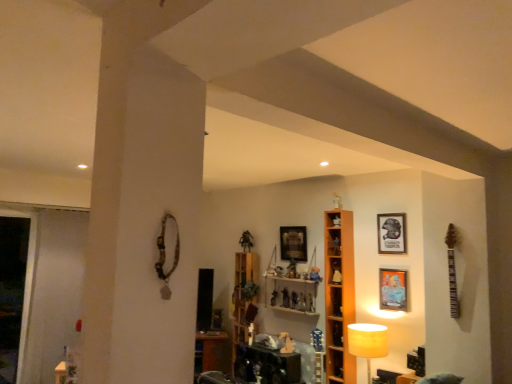
Question: Would you say wooden picture frame at upper center, the first picture frame from the back, is part of matte plastic figurine at center, positioned as the 4th toy in left-to-right order,'s contents?

Choices:
 (A) yes
 (B) no

Answer: (B)

Question: Considering the relative sizes of matte plastic figurine at center, the 1th toy in the right-to-left sequence, and wooden picture frame at upper center, the 1th picture frame from the left, in the image provided, is matte plastic figurine at center, the 1th toy in the right-to-left sequence, wider than wooden picture frame at upper center, the 1th picture frame from the left,?

Choices:
 (A) no
 (B) yes

Answer: (A)

Question: Is matte plastic figurine at center, positioned as the 4th toy in left-to-right order, not near wooden picture frame at upper center, which appears as the third picture frame when viewed from the front?

Choices:
 (A) no
 (B) yes

Answer: (A)

Question: Is matte plastic figurine at center, positioned as the 4th toy in left-to-right order, looking in the opposite direction of wooden picture frame at upper center, the 1th picture frame from the left?

Choices:
 (A) no
 (B) yes

Answer: (A)

Question: Considering the relative sizes of matte plastic figurine at center, positioned as the 4th toy in left-to-right order, and wooden picture frame at upper center, acting as the 3th picture frame starting from the right, in the image provided, is matte plastic figurine at center, positioned as the 4th toy in left-to-right order, smaller than wooden picture frame at upper center, acting as the 3th picture frame starting from the right,?

Choices:
 (A) yes
 (B) no

Answer: (A)

Question: Is matte black picture frame at upper right, the 2th picture frame when ordered from front to back, situated inside white fabric lampshade at lower right or outside?

Choices:
 (A) outside
 (B) inside

Answer: (A)

Question: From their relative heights in the image, would you say matte black picture frame at upper right, which is counted as the 2th picture frame, starting from the back, is taller or shorter than white fabric lampshade at lower right?

Choices:
 (A) short
 (B) tall

Answer: (B)

Question: Considering the positions of matte black picture frame at upper right, the 2th picture frame when ordered from front to back, and white fabric lampshade at lower right in the image, is matte black picture frame at upper right, the 2th picture frame when ordered from front to back, wider or thinner than white fabric lampshade at lower right?

Choices:
 (A) thin
 (B) wide

Answer: (A)

Question: Considering their positions, is matte black picture frame at upper right, which is counted as the 1th picture frame, starting from the right, located in front of or behind white fabric lampshade at lower right?

Choices:
 (A) front
 (B) behind

Answer: (B)

Question: In terms of height, does matte black picture frame at upper right, which is counted as the 1th picture frame, starting from the right, look taller or shorter compared to transparent glass door at left?

Choices:
 (A) short
 (B) tall

Answer: (A)

Question: In the image, is matte black picture frame at upper right, the 2th picture frame when ordered from front to back, positioned in front of or behind transparent glass door at left?

Choices:
 (A) front
 (B) behind

Answer: (A)

Question: Based on their sizes in the image, would you say matte black picture frame at upper right, which is counted as the 1th picture frame, starting from the right, is bigger or smaller than transparent glass door at left?

Choices:
 (A) small
 (B) big

Answer: (A)

Question: Considering the positions of point (397, 215) and point (29, 286), is point (397, 215) closer or farther from the camera than point (29, 286)?

Choices:
 (A) farther
 (B) closer

Answer: (B)

Question: From the image's perspective, is orange wood shelf at center, marked as the second shelf in a left-to-right arrangement, positioned above or below matte orange picture frame at upper right, arranged as the third picture frame when viewed from the back?

Choices:
 (A) above
 (B) below

Answer: (B)

Question: Is orange wood shelf at center, marked as the second shelf in a left-to-right arrangement, situated inside matte orange picture frame at upper right, placed as the second picture frame when sorted from left to right, or outside?

Choices:
 (A) inside
 (B) outside

Answer: (B)